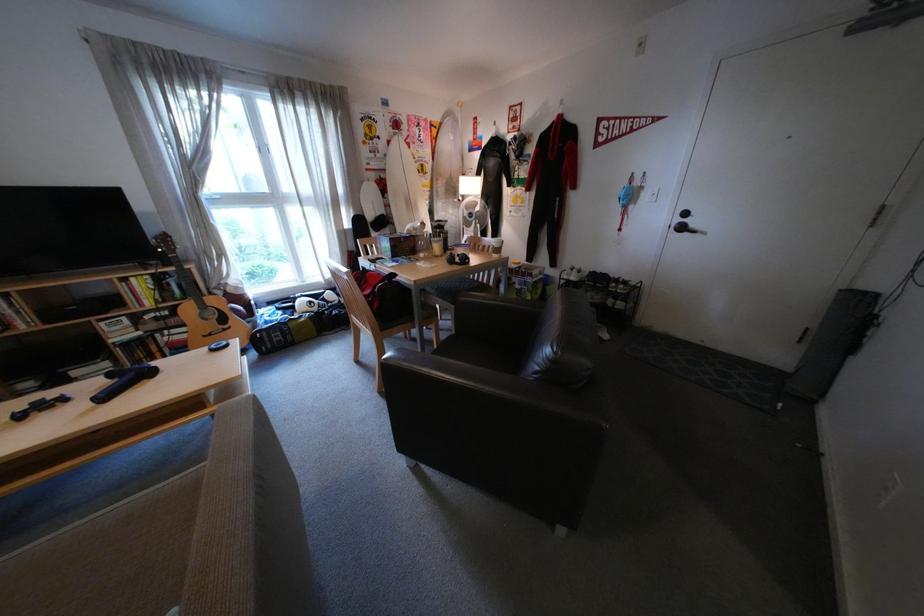
Find where to lift the black massage gun. Please return your answer as a coordinate pair (x, y).

(123, 381)